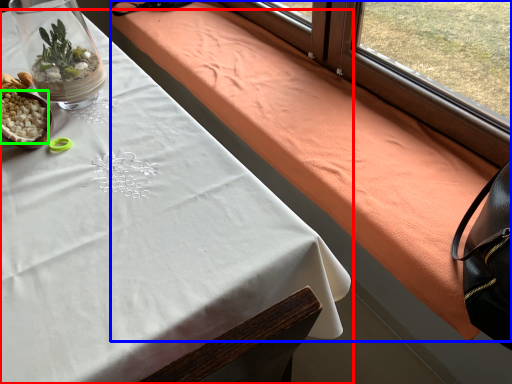
Question: Which object is the farthest from table (highlighted by a red box)? Choose among these: blanket (highlighted by a blue box) or food (highlighted by a green box).

Choices:
 (A) blanket
 (B) food

Answer: (A)